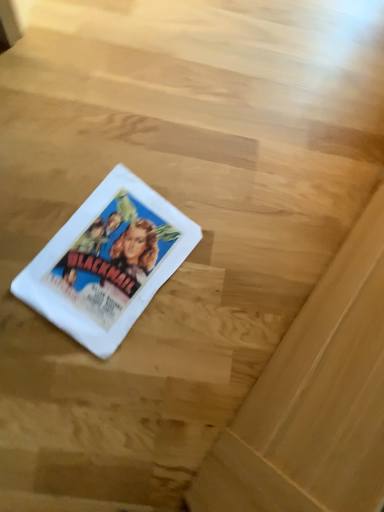
Question: Should I look upward or downward to see white fabric at center?

Choices:
 (A) down
 (B) up

Answer: (B)